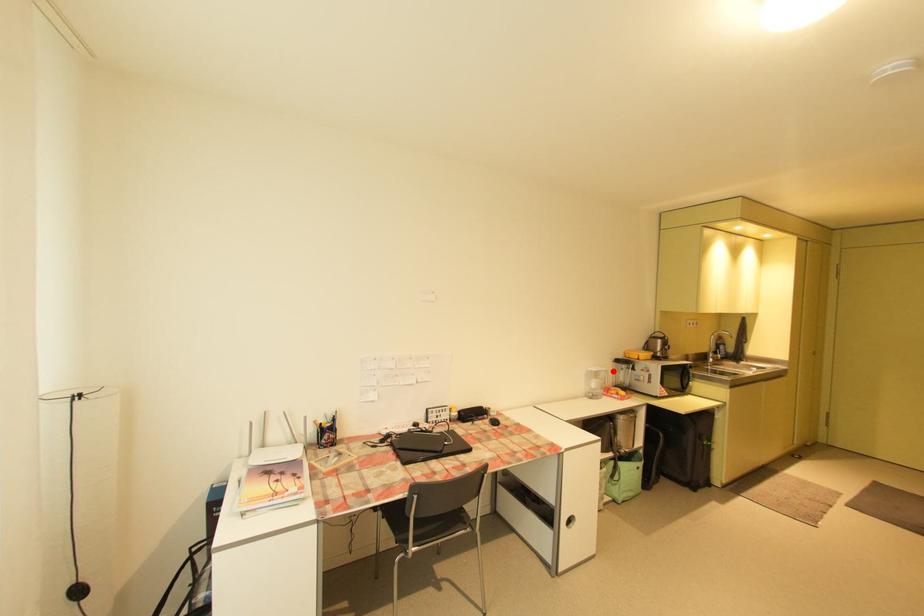
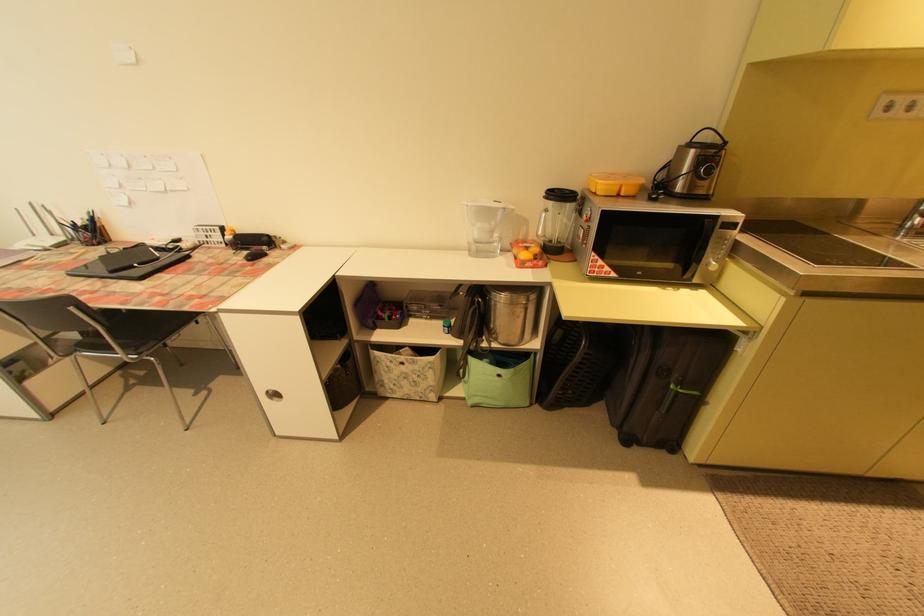
Locate, in the second image, the point that corresponds to the highlighted location in the first image.

(511, 209)